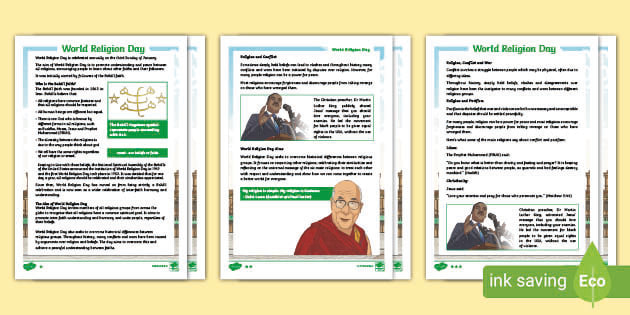
The height and width of the screenshot is (315, 630). In order to click on space between posters in this screenshot , I will do `click(220, 174)`, `click(419, 170)`.